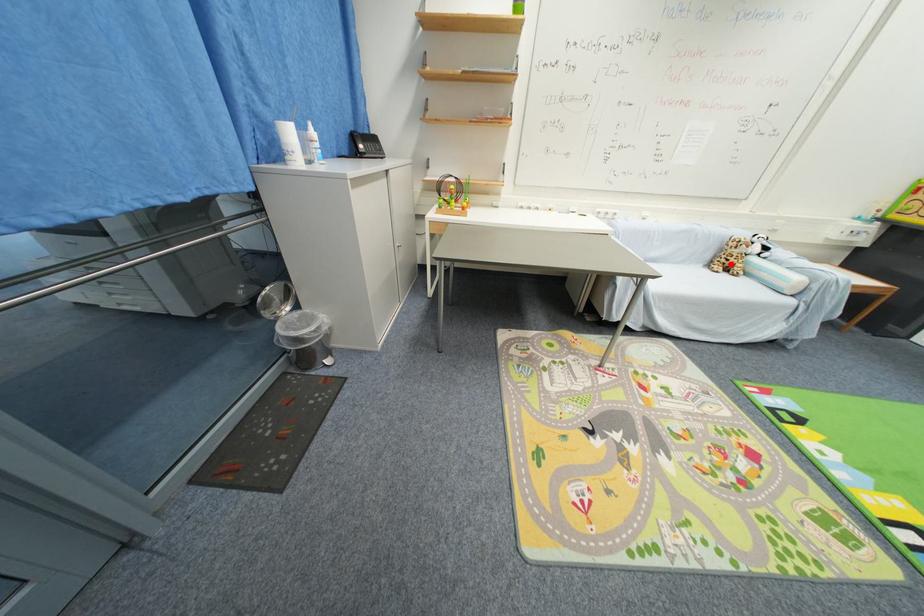
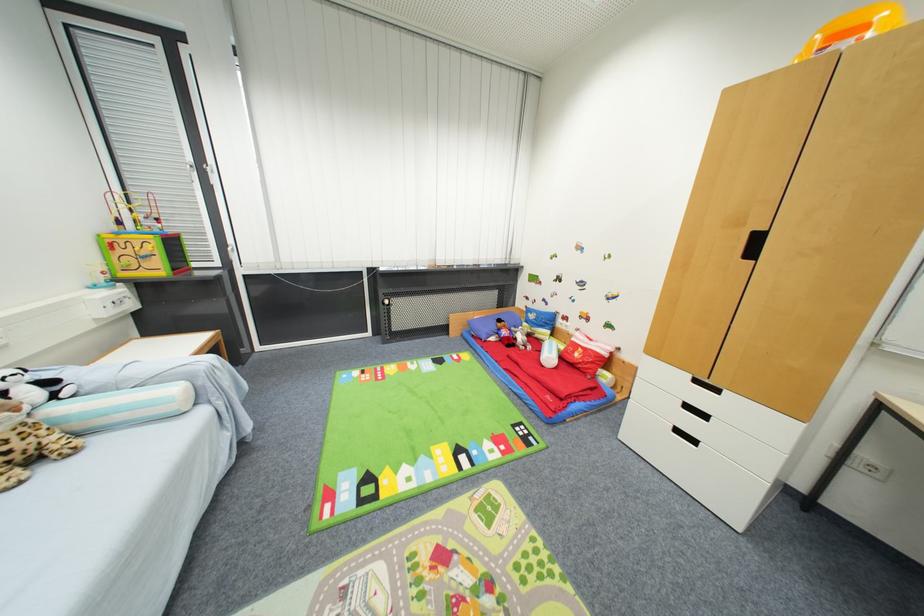
Question: I am providing you with two images of the same scene from different viewpoints. A red point is shown in image1. For the corresponding object point in image2, is it positioned nearer or farther from the camera?

Choices:
 (A) Nearer
 (B) Farther

Answer: (B)